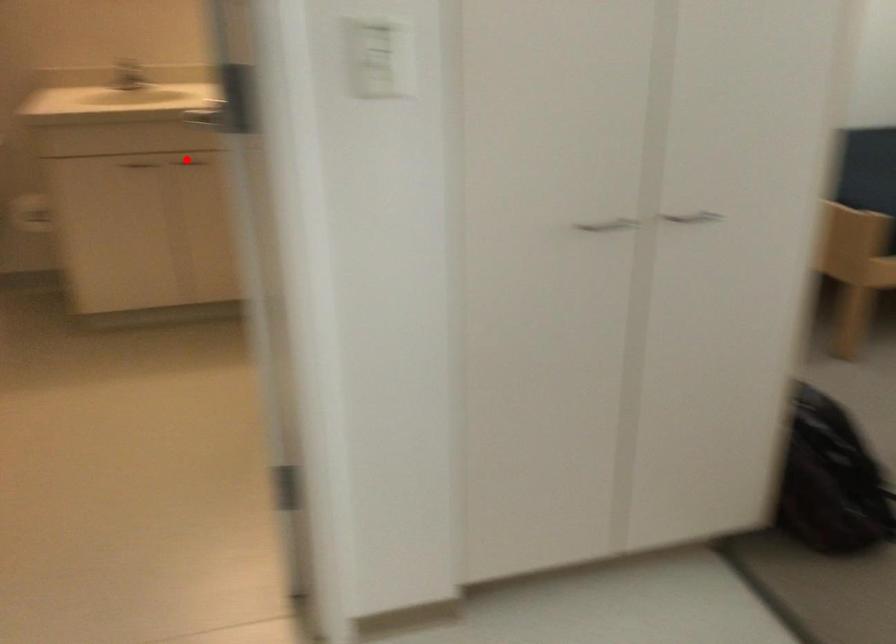
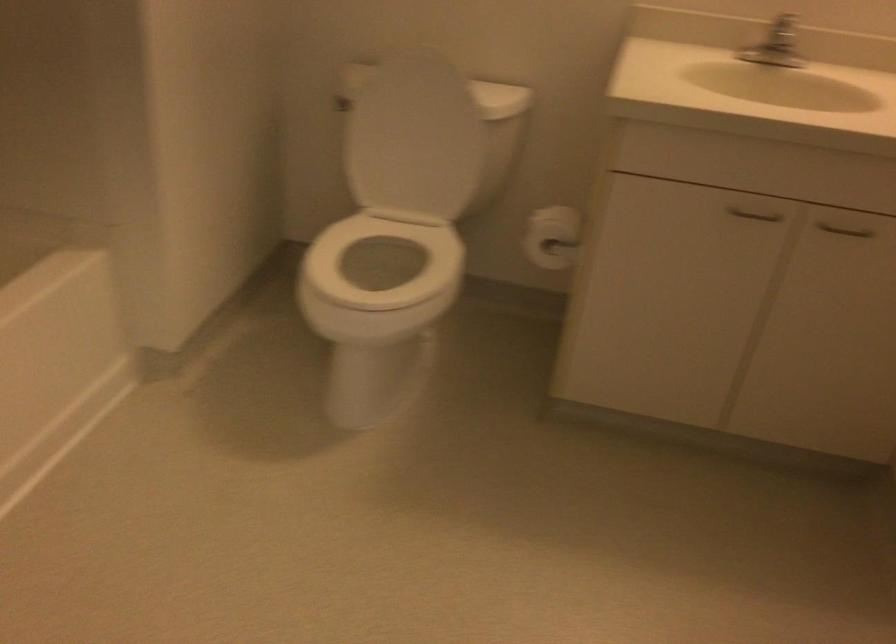
Find the pixel in the second image that matches the highlighted location in the first image.

(845, 230)